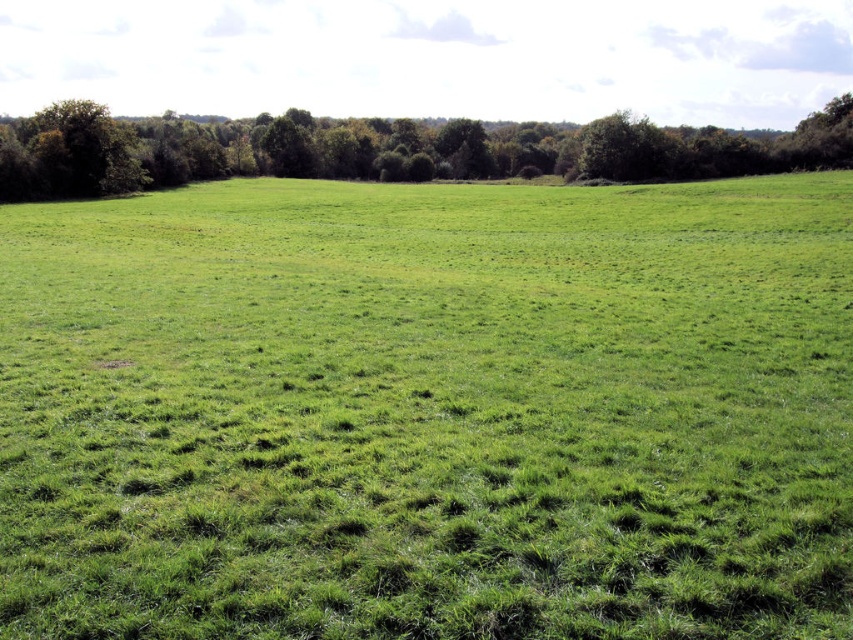
You are standing at the point labeled as point (428, 412) in the image. What type of terrain are you currently standing on?

The point (428, 412) corresponds to the green grassy pasture at center, so you are standing on a green grassy pasture.